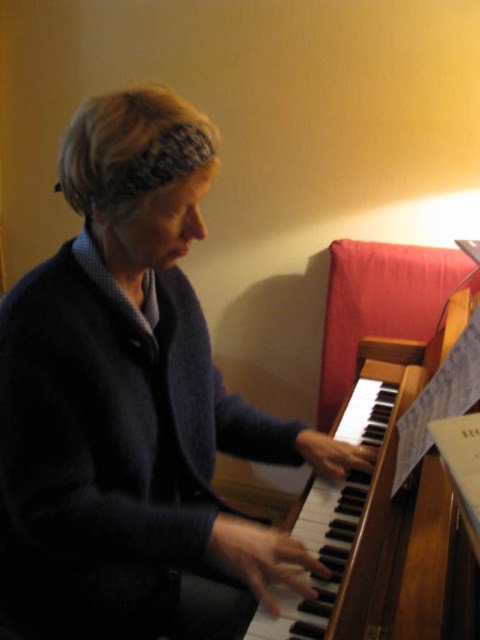
You are taking a photo of the piano scene. You want to focus on the point at point (70, 314) and point (344, 604). Which point should you focus on first to ensure the closest one is sharp?

Point (70, 314) is closer to the camera than point (344, 604), so you should focus on point (70, 314) first to ensure it is sharp.

You are a photographer setting up for a portrait. The subject is playing the piano with a dark blue sweater at center. You want to place a small decorative item at point (133, 406). Will the item be hidden by the dark blue sweater at center?

Yes, placing the item at point (133, 406) will hide it because the dark blue sweater at center is located there.

You are a photographer setting up for a photo shoot. You need to place a light source to the left of the dark blue sweater at center to highlight it. Based on the scene description, where should you position the light source relative to the sweater?

The dark blue sweater at center is located at point (133, 406). To place the light source to the left of it, position the light source to the left side of the dark blue sweater at center.